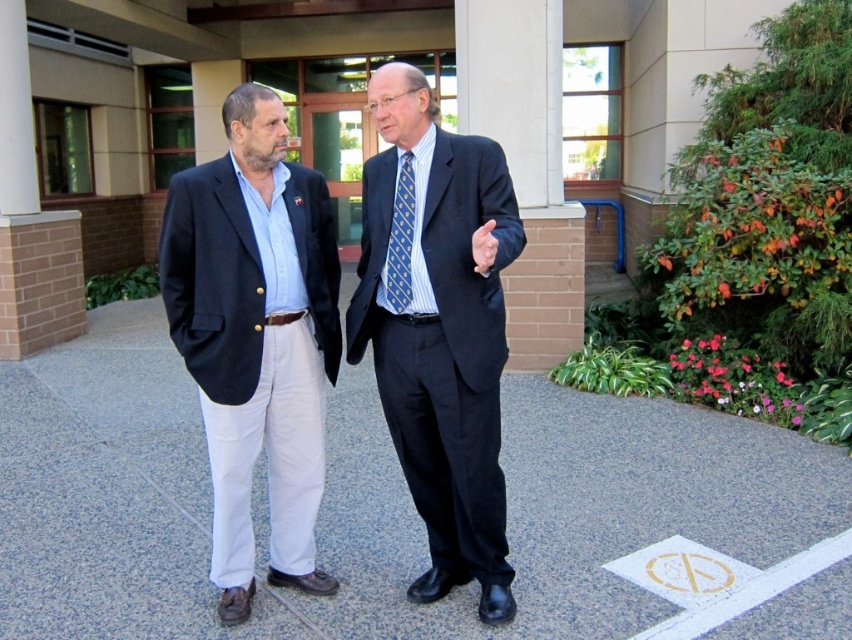
Between matte black blazer at left and blue textured tie at center, which one appears on the right side from the viewer's perspective?

blue textured tie at center

Consider the image. Who is higher up, matte black blazer at left or blue textured tie at center?

blue textured tie at center is above.

The height and width of the screenshot is (640, 852). Describe the element at coordinates (255, 337) in the screenshot. I see `matte black blazer at left` at that location.

Locate an element on the screen. matte black blazer at left is located at coordinates (255, 337).

Does point (481, 214) come in front of point (409, 150)?

Yes, it is in front of point (409, 150).

Can you confirm if matte black suit at center is bigger than blue textured tie at center?

Correct, matte black suit at center is larger in size than blue textured tie at center.

Is point (366, 221) positioned after point (406, 208)?

Yes, point (366, 221) is farther from viewer.

Identify the location of matte black suit at center. The image size is (852, 640). (438, 326).

Between matte black blazer at left and matte black suit at center, which one is positioned lower?

Positioned lower is matte black suit at center.

Does matte black blazer at left appear on the right side of matte black suit at center?

In fact, matte black blazer at left is to the left of matte black suit at center.

Who is more forward, (289, 364) or (448, 196)?

Point (448, 196) is in front.

The image size is (852, 640). What are the coordinates of `matte black blazer at left` in the screenshot? It's located at (255, 337).